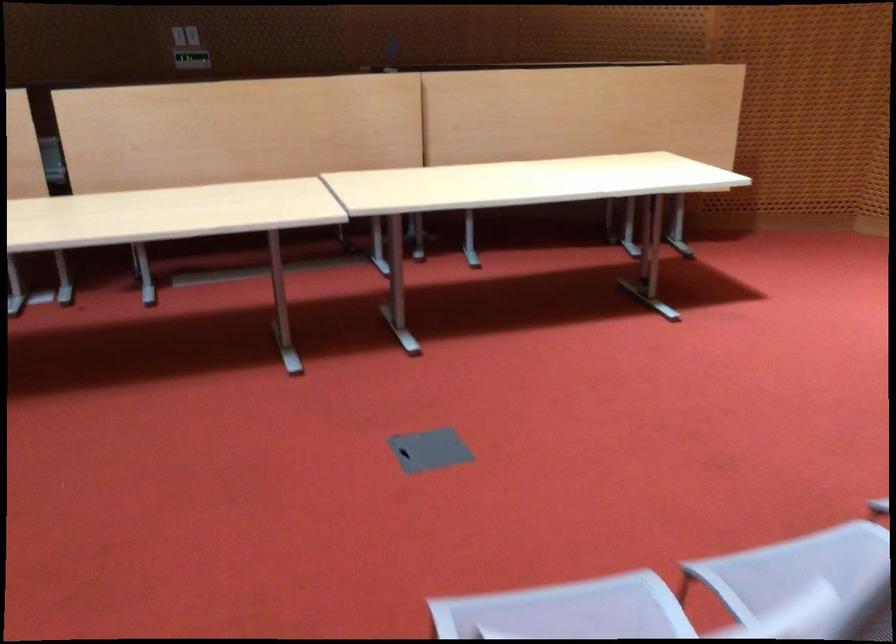
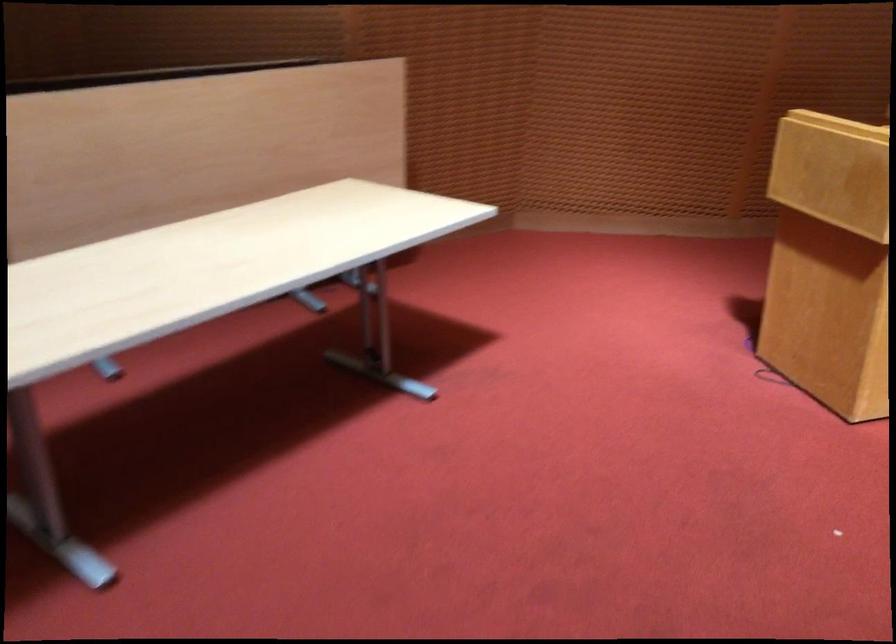
The first image is from the beginning of the video and the second image is from the end. How did the camera likely rotate when shooting the video?

The camera's rotation is toward right-down.